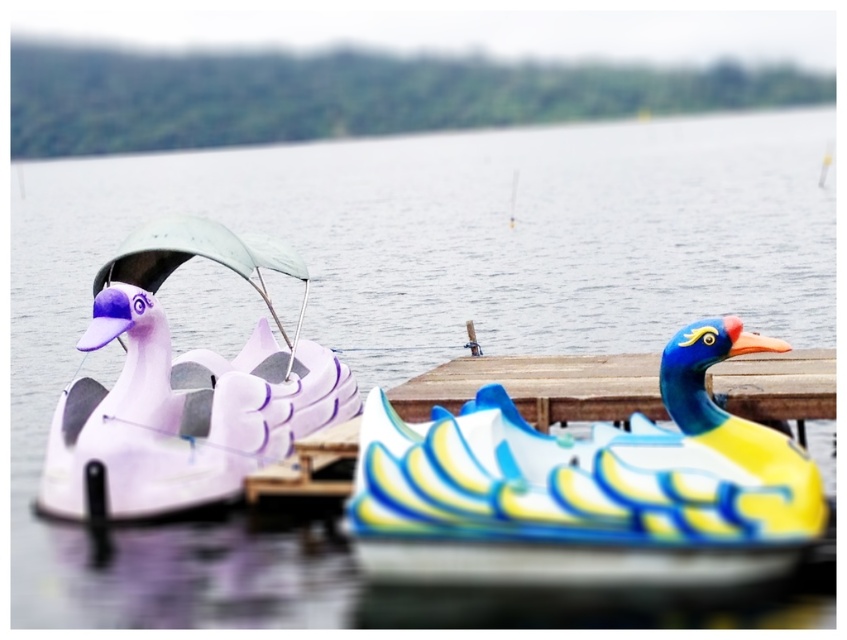
Does matte purple duck at left lie in front of wooden dock at center?

No, matte purple duck at left is further to the viewer.

Is point (213, 497) farther from viewer compared to point (646, 362)?

No, (213, 497) is closer to viewer.

The width and height of the screenshot is (847, 640). What are the coordinates of `matte purple duck at left` in the screenshot? It's located at (183, 388).

Where is `matte purple duck at left`? matte purple duck at left is located at coordinates (183, 388).